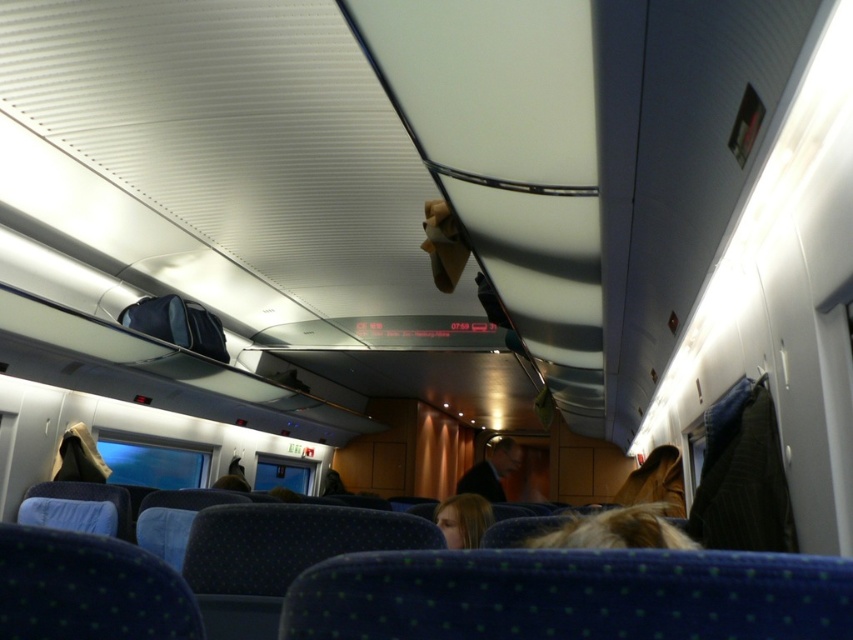
Who is more distant from viewer, (469, 504) or (503, 470)?

The point (503, 470) is behind.

Can you confirm if blonde hair at lower center is positioned to the left of dark blue fabric jacket at center?

Correct, you'll find blonde hair at lower center to the left of dark blue fabric jacket at center.

Identify the location of blonde hair at lower center. The width and height of the screenshot is (853, 640). (463, 518).